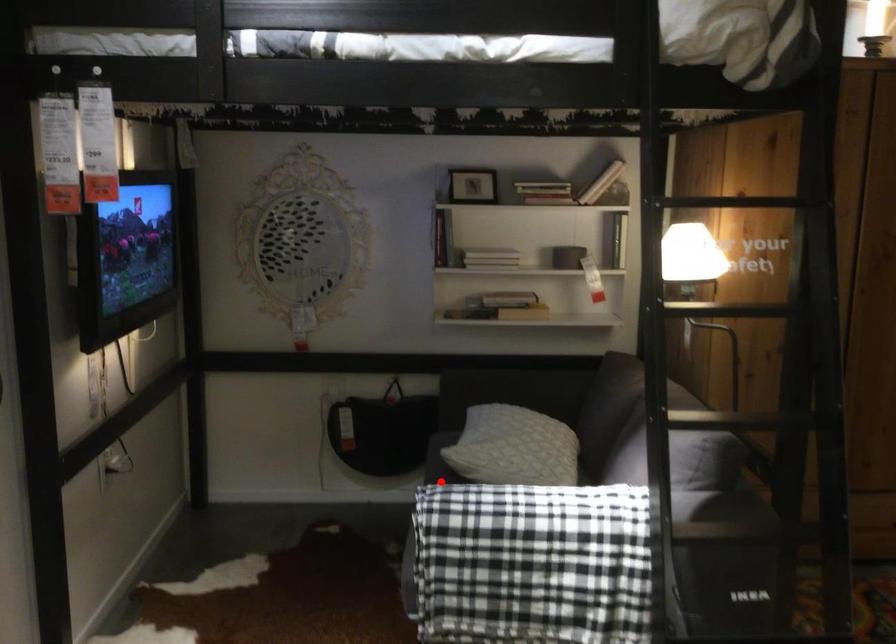
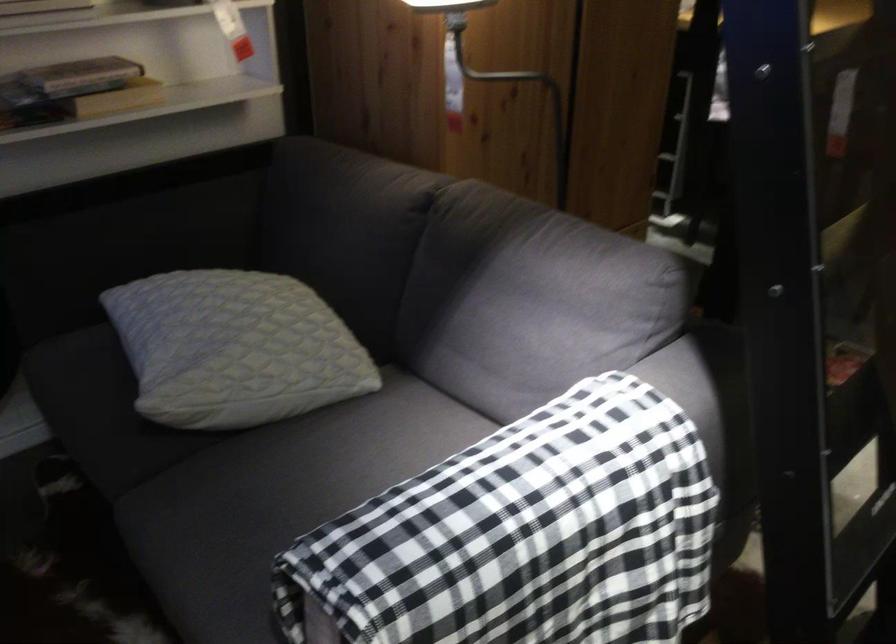
Question: I am providing you with two images of the same scene from different viewpoints. A red point is shown in image1. For the corresponding object point in image2, is it positioned nearer or farther from the camera?

Choices:
 (A) Nearer
 (B) Farther

Answer: (A)